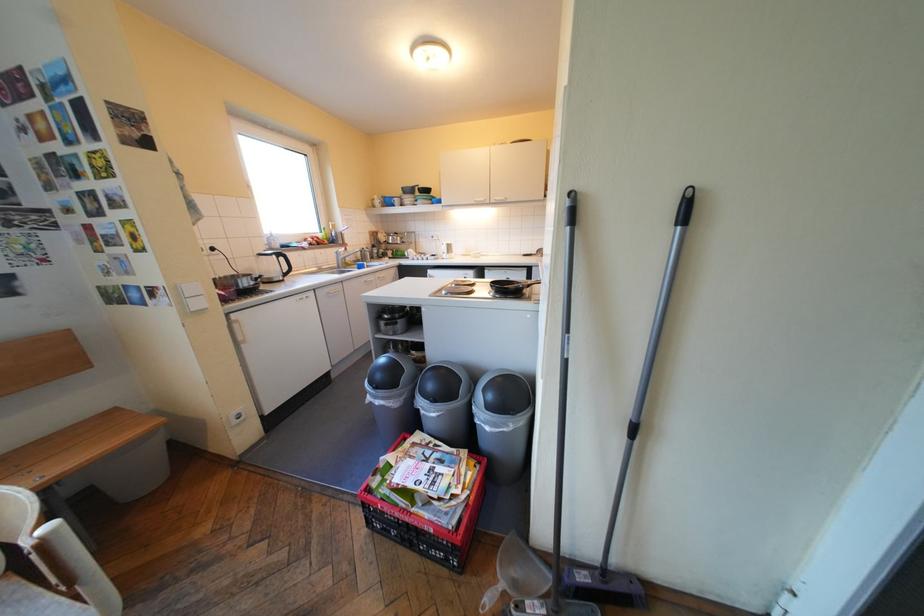
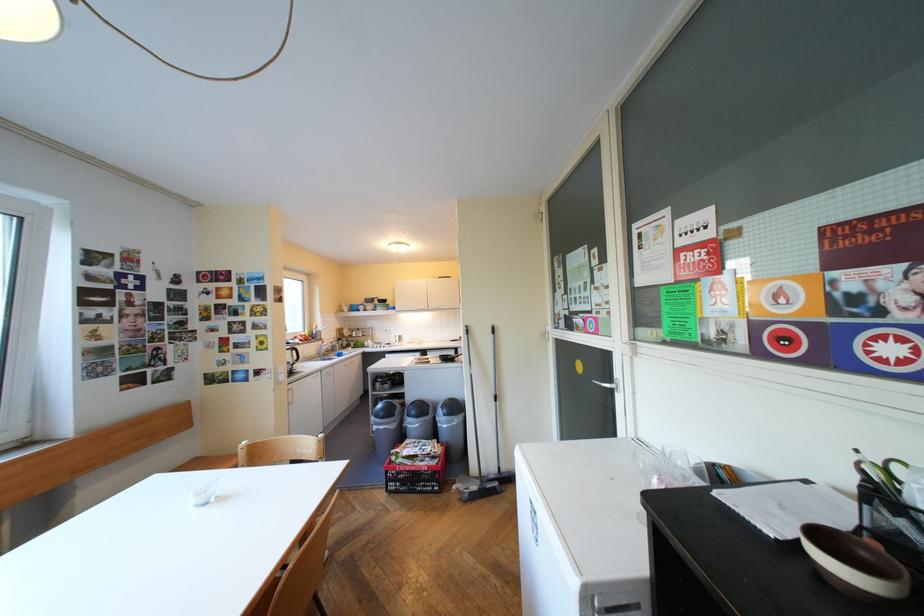
The point at (392,376) is marked in the first image. Where is the corresponding point in the second image?

(394, 411)